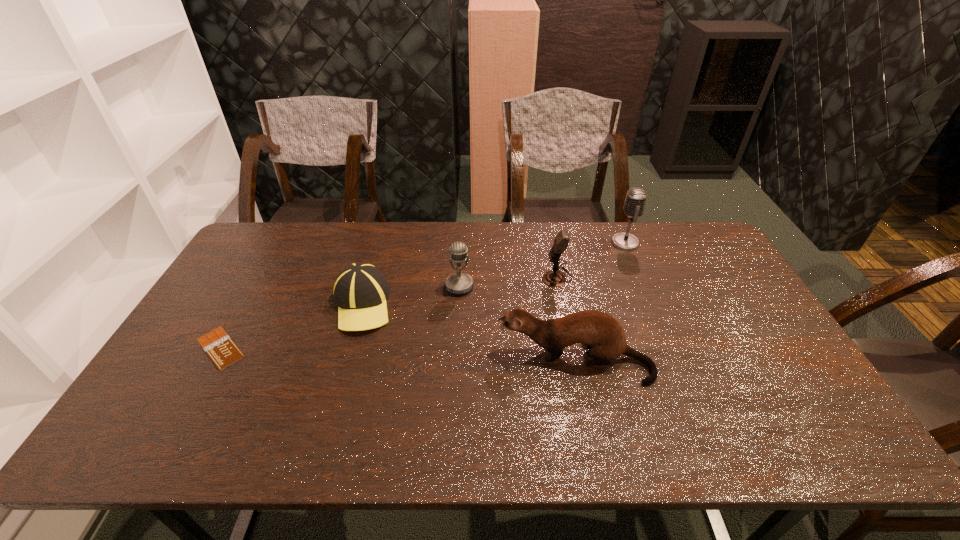
Find the location of a particular element. Image resolution: width=960 pixels, height=540 pixels. object that is at the left edge is located at coordinates (222, 350).

Where is `free region at the far edge of the desktop`? Image resolution: width=960 pixels, height=540 pixels. free region at the far edge of the desktop is located at coordinates (449, 222).

At what (x,y) coordinates should I click in order to perform the action: click on vacant space at the near edge of the desktop. Please return your answer as a coordinate pair (x, y). The height and width of the screenshot is (540, 960). Looking at the image, I should click on (296, 420).

Where is `free space at the left edge of the desktop`? This screenshot has width=960, height=540. free space at the left edge of the desktop is located at coordinates (252, 315).

Identify the location of vacant region at the far left corner of the desktop. (288, 228).

The width and height of the screenshot is (960, 540). In the image, there is a desktop. Identify the location of vacant space at the far right corner. (677, 238).

Identify the location of empty space between the second microphone from right to left and the chocolate bar. click(389, 312).

Find the location of `vacant space that's between the farthest microphone and the second microphone from right to left`. vacant space that's between the farthest microphone and the second microphone from right to left is located at coordinates (591, 260).

This screenshot has width=960, height=540. In order to click on free space between the second microphone from right to left and the leftmost object in this screenshot , I will do `click(389, 312)`.

Locate an element on the screen. Image resolution: width=960 pixels, height=540 pixels. vacant space in between the chocolate bar and the baseball cap is located at coordinates (291, 326).